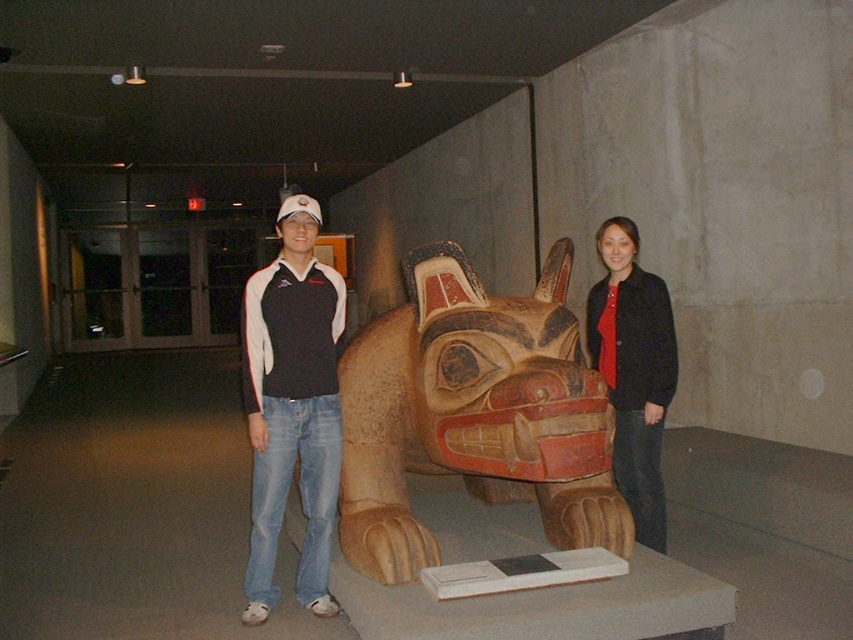
In the scene shown: Can you confirm if wooden totem pole at center is shorter than matte black jacket at center?

Correct, wooden totem pole at center is not as tall as matte black jacket at center.

Looking at this image, can you confirm if wooden totem pole at center is bigger than matte black jacket at center?

Yes, wooden totem pole at center is bigger than matte black jacket at center.

Does point (506, 372) lie behind point (636, 529)?

That is False.

Locate an element on the screen. The image size is (853, 640). wooden totem pole at center is located at coordinates (473, 413).

Is point (573, 348) behind point (256, 269)?

No, (573, 348) is in front of (256, 269).

Is wooden totem pole at center wider than matte black shirt at center?

Correct, the width of wooden totem pole at center exceeds that of matte black shirt at center.

Between point (514, 353) and point (321, 515), which one is positioned behind?

Point (321, 515)

Find the location of a particular element. This screenshot has height=640, width=853. wooden totem pole at center is located at coordinates (473, 413).

Is matte black shirt at center thinner than matte black jacket at center?

Incorrect, matte black shirt at center's width is not less than matte black jacket at center's.

This screenshot has height=640, width=853. Find the location of `matte black shirt at center`. matte black shirt at center is located at coordinates (292, 406).

What do you see at coordinates (292, 406) in the screenshot?
I see `matte black shirt at center` at bounding box center [292, 406].

Find the location of a particular element. matte black shirt at center is located at coordinates (292, 406).